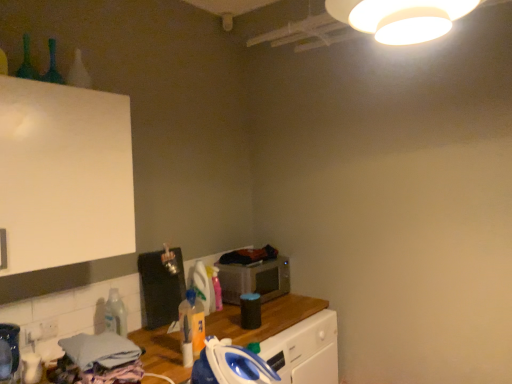
The width and height of the screenshot is (512, 384). I want to click on blue plastic iron at lower center, so click(230, 365).

Describe the element at coordinates (230, 365) in the screenshot. I see `blue plastic iron at lower center` at that location.

This screenshot has width=512, height=384. What are the coordinates of `clear plastic bottle at lower left, acting as the 3th bottle starting from the front` in the screenshot? It's located at (115, 314).

This screenshot has width=512, height=384. Describe the element at coordinates (192, 322) in the screenshot. I see `translucent plastic bottle at center, which is the third bottle in left-to-right order` at that location.

Where is `translucent plastic bottle at center, acting as the second bottle starting from the bottom`? translucent plastic bottle at center, acting as the second bottle starting from the bottom is located at coordinates (192, 322).

Locate an element on the screen. green glass bottle at upper left, which is the 3th bottle in bottom-to-top order is located at coordinates (52, 65).

Is metallic silver microwave at center positioned beyond the bounds of green glass bottle at upper left, which is the third bottle in back-to-front order?

Absolutely, metallic silver microwave at center is external to green glass bottle at upper left, which is the third bottle in back-to-front order.

From a real-world perspective, is metallic silver microwave at center over green glass bottle at upper left, the 1th bottle viewed from the left?

No, from a real-world perspective, metallic silver microwave at center is not over green glass bottle at upper left, the 1th bottle viewed from the left

Which is behind, point (287, 288) or point (55, 53)?

Point (287, 288)

Which object is wider, metallic silver microwave at center or green glass bottle at upper left, which is the first bottle from top to bottom?

Wider between the two is metallic silver microwave at center.

From the picture: From a real-world perspective, is metallic silver microwave at center physically located above or below clear plastic bottle at lower left, which is the first bottle from bottom to top?

metallic silver microwave at center is below clear plastic bottle at lower left, which is the first bottle from bottom to top.

Does metallic silver microwave at center come behind clear plastic bottle at lower left, acting as the 2th bottle starting from the right?

Yes, it is.

Are metallic silver microwave at center and clear plastic bottle at lower left, which is the first bottle from bottom to top, located far from each other?

metallic silver microwave at center is near clear plastic bottle at lower left, which is the first bottle from bottom to top, not far away.

Is metallic silver microwave at center situated inside clear plastic bottle at lower left, the second bottle positioned from the left, or outside?

metallic silver microwave at center is spatially situated outside clear plastic bottle at lower left, the second bottle positioned from the left.

Looking at this image, which object is positioned more to the right, translucent plastic bottle at center, which is the third bottle in left-to-right order, or green glass bottle at upper left, acting as the 3th bottle starting from the right?

Positioned to the right is translucent plastic bottle at center, which is the third bottle in left-to-right order.

Considering the sizes of translucent plastic bottle at center, which appears as the 2th bottle when viewed from the back, and green glass bottle at upper left, which is the first bottle from top to bottom, in the image, is translucent plastic bottle at center, which appears as the 2th bottle when viewed from the back, wider or thinner than green glass bottle at upper left, which is the first bottle from top to bottom,?

Considering their sizes, translucent plastic bottle at center, which appears as the 2th bottle when viewed from the back, looks broader than green glass bottle at upper left, which is the first bottle from top to bottom.

From the image's perspective, count 1st bottles downward from the green glass bottle at upper left, which is the third bottle in back-to-front order, and point to it. Please provide its 2D coordinates.

[(192, 322)]

Could you measure the distance between translucent plastic bottle at center, the second bottle from the top, and green glass bottle at upper left, which is the third bottle in back-to-front order?

The distance of translucent plastic bottle at center, the second bottle from the top, from green glass bottle at upper left, which is the third bottle in back-to-front order, is 1.28 meters.

From the image's perspective, is translucent plastic bottle at center, which appears as the second bottle when viewed from the front, above or below metallic silver microwave at center?

Based on their image positions, translucent plastic bottle at center, which appears as the second bottle when viewed from the front, is located beneath metallic silver microwave at center.

Are translucent plastic bottle at center, which is the third bottle in left-to-right order, and metallic silver microwave at center beside each other?

translucent plastic bottle at center, which is the third bottle in left-to-right order, and metallic silver microwave at center are clearly separated.

From a real-world perspective, is translucent plastic bottle at center, the second bottle from the top, over metallic silver microwave at center?

Correct, in the physical world, translucent plastic bottle at center, the second bottle from the top, is higher than metallic silver microwave at center.

Which is farther, (188, 312) or (263, 262)?

The point (263, 262) is behind.

What's the angular difference between metallic silver microwave at center and blue plastic iron at lower center's facing directions?

They differ by 0.947 degrees in their facing directions.

From the picture: Is metallic silver microwave at center oriented away from blue plastic iron at lower center?

No, metallic silver microwave at center is not facing the opposite direction of blue plastic iron at lower center.

From the image's perspective, is metallic silver microwave at center on blue plastic iron at lower center?

Yes.

Considering the positions of objects metallic silver microwave at center and blue plastic iron at lower center in the image provided, who is in front, metallic silver microwave at center or blue plastic iron at lower center?

blue plastic iron at lower center is closer to the camera.

From a real-world perspective, is blue plastic iron at lower center positioned over clear plastic bottle at lower left, which is the first bottle from bottom to top, based on gravity?

No, from a real-world perspective, blue plastic iron at lower center is not above clear plastic bottle at lower left, which is the first bottle from bottom to top.

Can you confirm if blue plastic iron at lower center is smaller than clear plastic bottle at lower left, marked as the third bottle in a top-to-bottom arrangement?

Incorrect, blue plastic iron at lower center is not smaller in size than clear plastic bottle at lower left, marked as the third bottle in a top-to-bottom arrangement.

Could you tell me if blue plastic iron at lower center is facing clear plastic bottle at lower left, the second bottle positioned from the left?

No.

Considering the positions of points (197, 361) and (124, 320), is point (197, 361) closer to camera compared to point (124, 320)?

Yes, point (197, 361) is in front of point (124, 320).

Is translucent plastic bottle at center, which is the third bottle in left-to-right order, smaller than clear plastic bottle at lower left, which is the first bottle from bottom to top?

Indeed, translucent plastic bottle at center, which is the third bottle in left-to-right order, has a smaller size compared to clear plastic bottle at lower left, which is the first bottle from bottom to top.

This screenshot has width=512, height=384. Find the location of `the 1st bottle positioned above the clear plastic bottle at lower left, which is the 1th bottle in back-to-front order (from a real-world perspective)`. the 1st bottle positioned above the clear plastic bottle at lower left, which is the 1th bottle in back-to-front order (from a real-world perspective) is located at coordinates (192, 322).

From a real-world perspective, which is physically below, translucent plastic bottle at center, acting as the second bottle starting from the bottom, or clear plastic bottle at lower left, the second bottle positioned from the left?

clear plastic bottle at lower left, the second bottle positioned from the left, is physically lower.

From their relative heights in the image, would you say translucent plastic bottle at center, which appears as the second bottle when viewed from the front, is taller or shorter than clear plastic bottle at lower left, acting as the 2th bottle starting from the right?

Considering their sizes, translucent plastic bottle at center, which appears as the second bottle when viewed from the front, has more height than clear plastic bottle at lower left, acting as the 2th bottle starting from the right.

This screenshot has height=384, width=512. What are the coordinates of `microwave oven that appears below the green glass bottle at upper left, the 1th bottle viewed from the left (from the image's perspective)` in the screenshot? It's located at (255, 279).

I want to click on microwave oven above the clear plastic bottle at lower left, which is the 1th bottle in back-to-front order (from the image's perspective), so click(x=255, y=279).

Based on their spatial positions, is translucent plastic bottle at center, the 1th bottle in the right-to-left sequence, or blue plastic iron at lower center closer to green glass bottle at upper left, which is the 3th bottle in bottom-to-top order?

translucent plastic bottle at center, the 1th bottle in the right-to-left sequence, is closer to green glass bottle at upper left, which is the 3th bottle in bottom-to-top order.

Estimate the real-world distances between objects in this image. Which object is further from translucent plastic bottle at center, which appears as the 2th bottle when viewed from the back, clear plastic bottle at lower left, acting as the 3th bottle starting from the front, or green glass bottle at upper left, the 1th bottle viewed from the left?

green glass bottle at upper left, the 1th bottle viewed from the left, is further to translucent plastic bottle at center, which appears as the 2th bottle when viewed from the back.

Looking at the image, which one is located closer to blue plastic iron at lower center, clear plastic bottle at lower left, acting as the 3th bottle starting from the front, or metallic silver microwave at center?

Among the two, clear plastic bottle at lower left, acting as the 3th bottle starting from the front, is located nearer to blue plastic iron at lower center.

Estimate the real-world distances between objects in this image. Which object is closer to metallic silver microwave at center, clear plastic bottle at lower left, which is the 1th bottle in back-to-front order, or translucent plastic bottle at center, the second bottle from the top?

translucent plastic bottle at center, the second bottle from the top, is positioned closer to the anchor metallic silver microwave at center.

Estimate the real-world distances between objects in this image. Which object is closer to clear plastic bottle at lower left, which is the 1th bottle in back-to-front order, blue plastic iron at lower center or green glass bottle at upper left, acting as the 3th bottle starting from the right?

Among the two, blue plastic iron at lower center is located nearer to clear plastic bottle at lower left, which is the 1th bottle in back-to-front order.

From the image, which object appears to be farther from green glass bottle at upper left, acting as the 3th bottle starting from the right, blue plastic iron at lower center or metallic silver microwave at center?

Based on the image, metallic silver microwave at center appears to be further to green glass bottle at upper left, acting as the 3th bottle starting from the right.

From the image, which object appears to be nearer to blue plastic iron at lower center, metallic silver microwave at center or green glass bottle at upper left, which is the third bottle in back-to-front order?

metallic silver microwave at center is positioned closer to the anchor blue plastic iron at lower center.

Looking at the image, which one is located closer to clear plastic bottle at lower left, which is the 1th bottle in back-to-front order, translucent plastic bottle at center, acting as the second bottle starting from the bottom, or metallic silver microwave at center?

translucent plastic bottle at center, acting as the second bottle starting from the bottom, lies closer to clear plastic bottle at lower left, which is the 1th bottle in back-to-front order, than the other object.

You are a GUI agent. You are given a task and a screenshot of the screen. Output one action in this format:
    pyautogui.click(x=<x>, y=<y>)
    Task: Click on the bottle between translucent plastic bottle at center, the second bottle from the top, and metallic silver microwave at center from front to back
    The image size is (512, 384).
    Given the screenshot: What is the action you would take?
    pyautogui.click(x=115, y=314)

This screenshot has width=512, height=384. I want to click on microwave oven between green glass bottle at upper left, which is the first bottle from top to bottom, and blue plastic iron at lower center in the up-down direction, so click(x=255, y=279).

Where is `bottle that lies between green glass bottle at upper left, which is the 1th bottle in front-to-back order, and clear plastic bottle at lower left, the second bottle positioned from the left, from top to bottom`? The width and height of the screenshot is (512, 384). bottle that lies between green glass bottle at upper left, which is the 1th bottle in front-to-back order, and clear plastic bottle at lower left, the second bottle positioned from the left, from top to bottom is located at coordinates (192, 322).

Identify the location of microwave oven between green glass bottle at upper left, the 1th bottle viewed from the left, and translucent plastic bottle at center, which is the third bottle in left-to-right order, vertically. This screenshot has width=512, height=384. (255, 279).